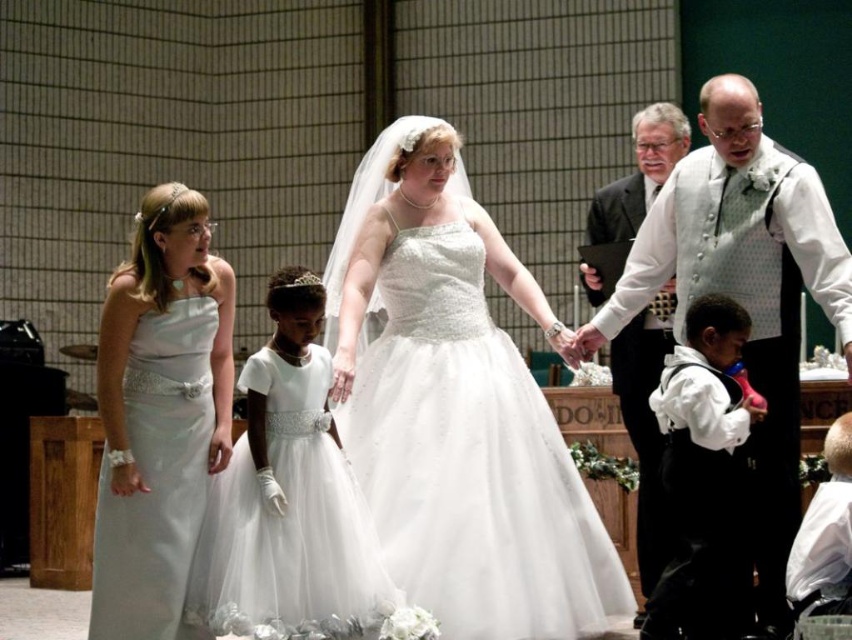
Question: Is white dotted vest at center wider than black satin vest at right?

Choices:
 (A) yes
 (B) no

Answer: (A)

Question: Is white satin dress at center thinner than white dotted vest at center?

Choices:
 (A) no
 (B) yes

Answer: (A)

Question: Which point is closer to the camera taking this photo?

Choices:
 (A) (597, 250)
 (B) (747, 451)
 (C) (407, 285)
 (D) (137, 428)

Answer: (D)

Question: Among these objects, which one is nearest to the camera?

Choices:
 (A) black satin vest at right
 (B) satin white dress at left
 (C) white tulle dress at center
 (D) white satin dress at center

Answer: (C)

Question: Among these points, which one is nearest to the camera?

Choices:
 (A) (338, 616)
 (B) (796, 163)

Answer: (A)

Question: Is white satin dress at center to the right of satin white dress at left from the viewer's perspective?

Choices:
 (A) no
 (B) yes

Answer: (B)